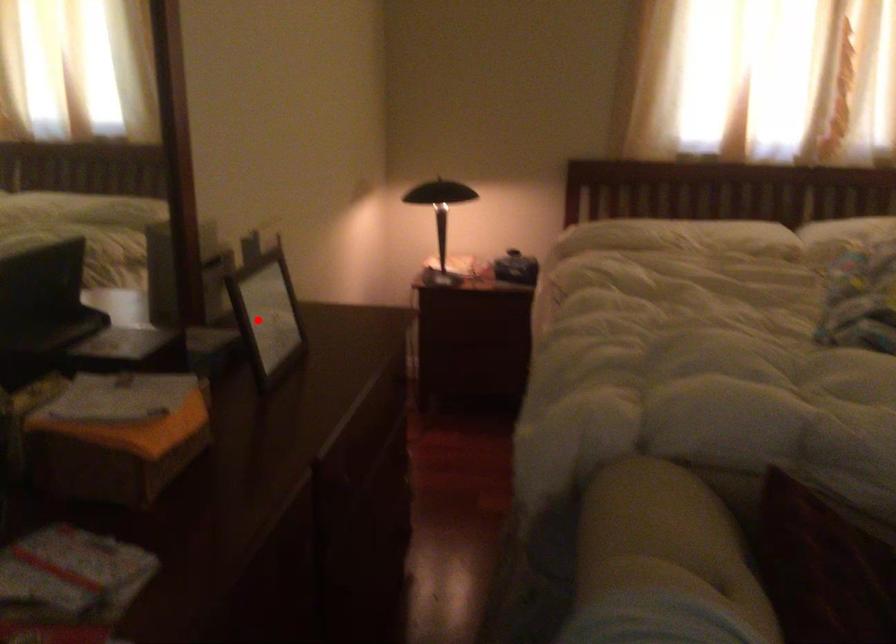
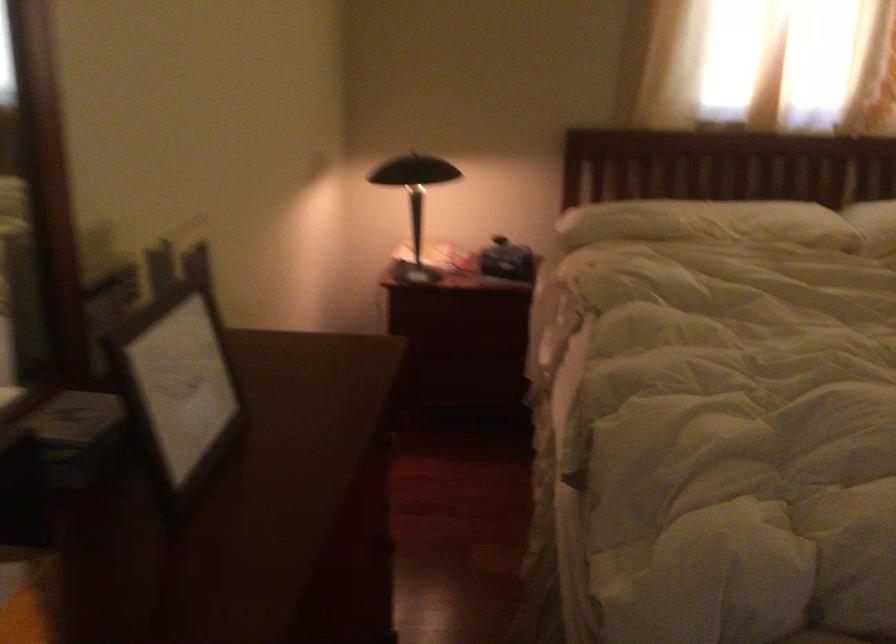
Question: I am providing you with two images of the same scene from different viewpoints. Given a red point in image1, look at the same physical point in image2. Is it:

Choices:
 (A) Closer to the viewpoint
 (B) Farther from the viewpoint

Answer: (A)